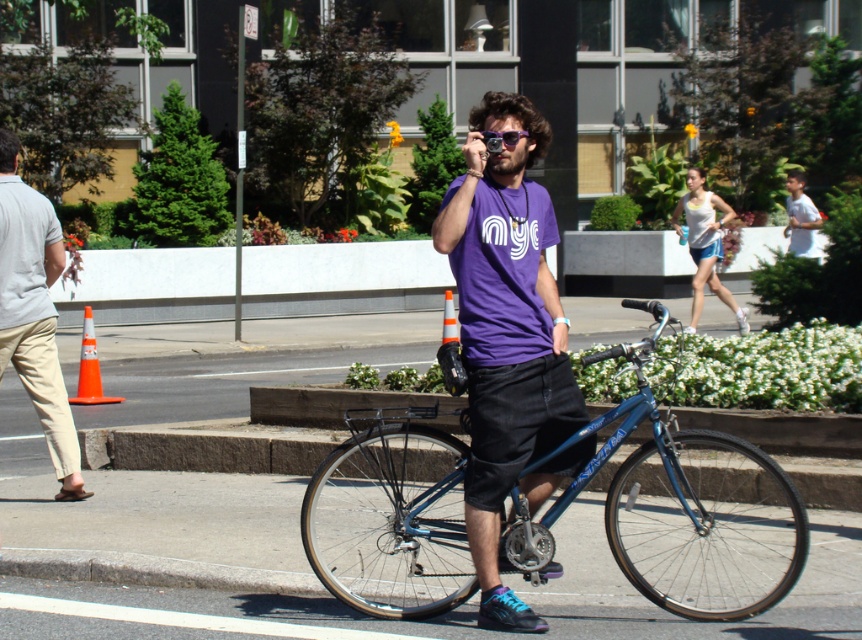
You are a fashion designer observing the man in the street scene. You need to determine which item of his clothing or accessory has a greater height between the light beige pants at left and the purple reflective sunglasses at center. Which one is taller?

The light beige pants at left has a greater height compared to the purple reflective sunglasses at center, so the light beige pants at left is taller.